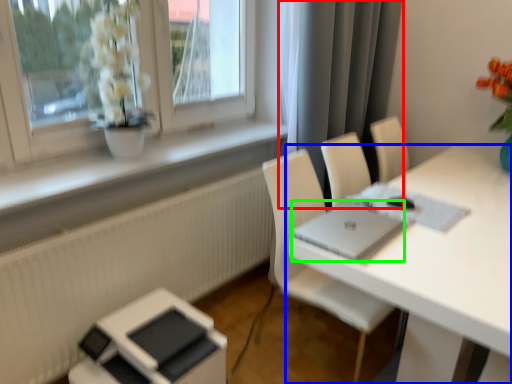
Question: Which object is positioned closest to curtain (highlighted by a red box)? Select from table (highlighted by a blue box) and laptop (highlighted by a green box).

Choices:
 (A) table
 (B) laptop

Answer: (A)